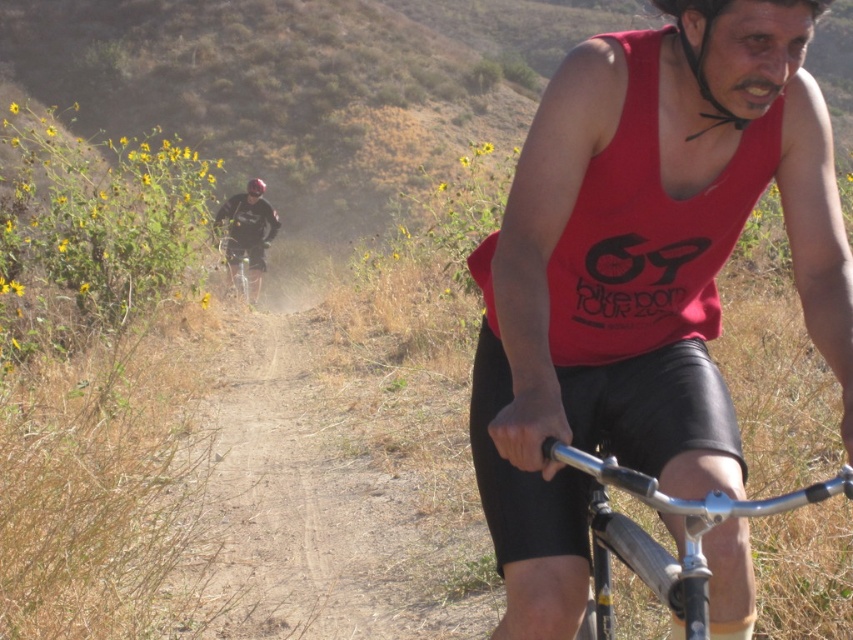
Which of these two, black matte bicycle helmet at upper center or shiny black helmet at upper center, stands taller?

With more height is shiny black helmet at upper center.

Is point (706, 4) farther from viewer compared to point (247, 189)?

No.

Locate an element on the screen. black matte bicycle helmet at upper center is located at coordinates (701, 54).

In order to click on black matte bicycle helmet at upper center in this screenshot , I will do `click(701, 54)`.

Measure the distance between red matte tank top at center and camera.

The distance of red matte tank top at center from camera is 6.10 feet.

How much distance is there between red matte tank top at center and shiny black helmet at upper center?

They are 17.46 meters apart.

Find the location of a particular element. The width and height of the screenshot is (853, 640). red matte tank top at center is located at coordinates (642, 275).

Is point (614, 60) behind point (257, 273)?

No, (614, 60) is in front of (257, 273).

Between red matte tank top at center and metallic silver bicycle at center, which one appears on the left side from the viewer's perspective?

metallic silver bicycle at center

Find the location of a particular element. red matte tank top at center is located at coordinates (642, 275).

Where is `red matte tank top at center`? red matte tank top at center is located at coordinates (642, 275).